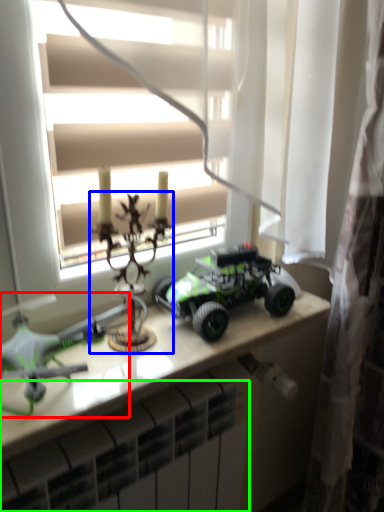
Question: Which is farther away from toy (highlighted by a red box)? toy (highlighted by a blue box) or radiator (highlighted by a green box)?

Choices:
 (A) toy
 (B) radiator

Answer: (B)